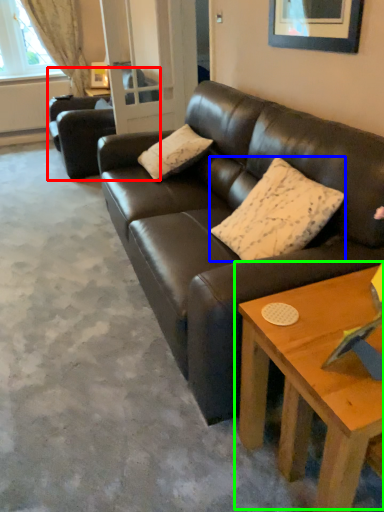
Question: Estimate the real-world distances between objects in this image. Which object is farther from studio couch (highlighted by a red box), pillow (highlighted by a blue box) or coffee table (highlighted by a green box)?

Choices:
 (A) pillow
 (B) coffee table

Answer: (B)